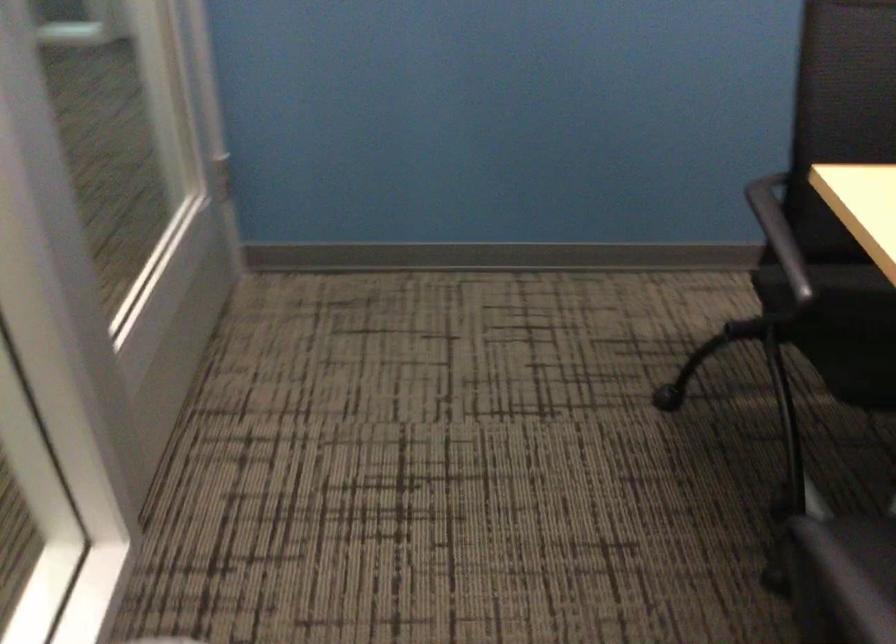
The image size is (896, 644). I want to click on black chair armrest, so click(779, 232).